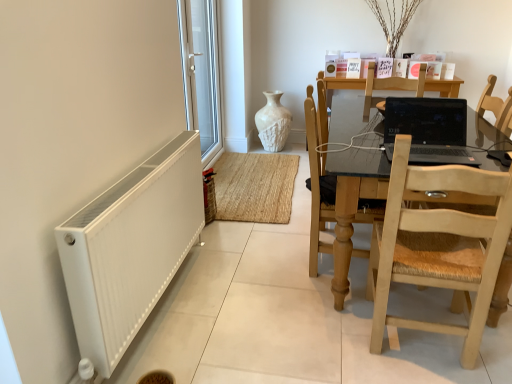
In order to click on vacant space that is in between light wood/rattan chair at right, positioned as the 2th chair in back-to-front order, and light wood table at right in this screenshot , I will do `click(419, 346)`.